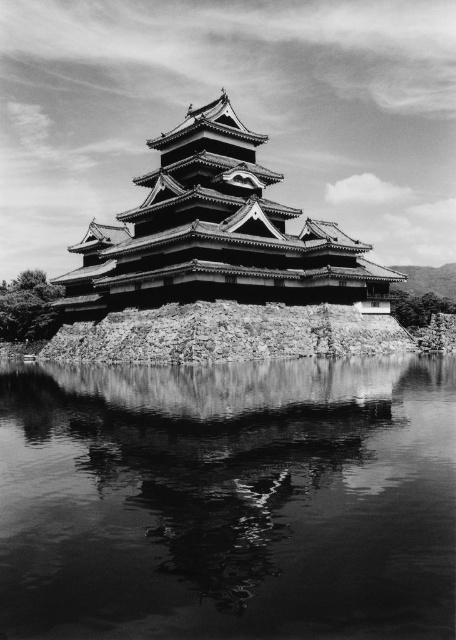
Is smooth reflective water at center below wooden pagoda at center?

Correct, smooth reflective water at center is located below wooden pagoda at center.

Between point (341, 579) and point (186, 228), which one is positioned in front?

Point (341, 579) is in front.

In order to click on smooth reflective water at center in this screenshot , I will do `click(228, 500)`.